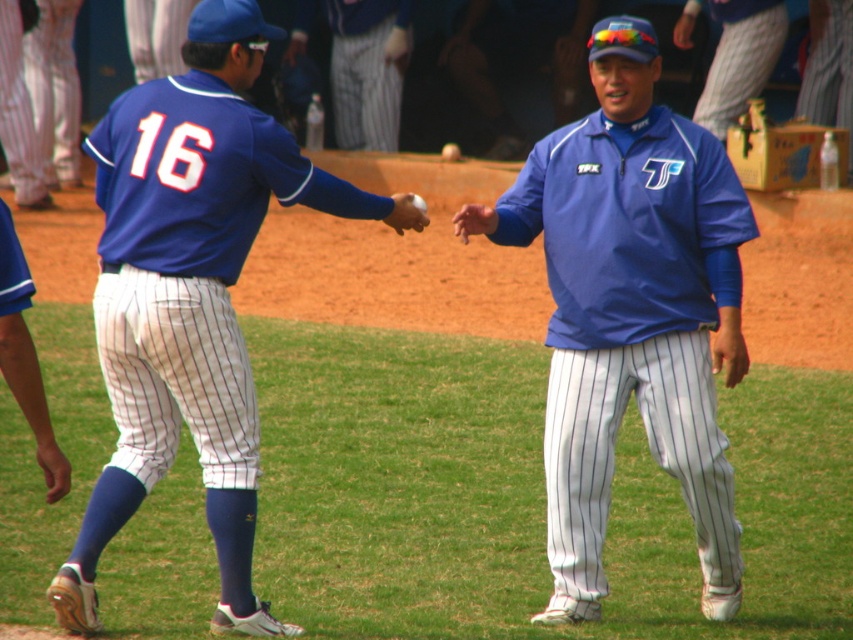
Question: Among these objects, which one is nearest to the camera?

Choices:
 (A) matte blue jersey at center
 (B) blue fabric shirt at center
 (C) white pinstriped pants at center

Answer: (A)

Question: From the image, what is the correct spatial relationship of blue fabric shirt at center in relation to white pinstriped pants at center?

Choices:
 (A) right
 (B) left

Answer: (B)

Question: Which point appears farthest from the camera in this image?

Choices:
 (A) (567, 376)
 (B) (180, 388)
 (C) (761, 77)
 (D) (22, 184)

Answer: (C)

Question: Which object is closer to the camera taking this photo?

Choices:
 (A) blue fabric shirt at center
 (B) white pinstriped pants at center

Answer: (A)

Question: Does matte blue jersey at center lie behind white pinstriped pants at lower left?

Choices:
 (A) yes
 (B) no

Answer: (B)

Question: Can you confirm if matte blue jersey at center is positioned above white pinstriped pants at center?

Choices:
 (A) yes
 (B) no

Answer: (B)